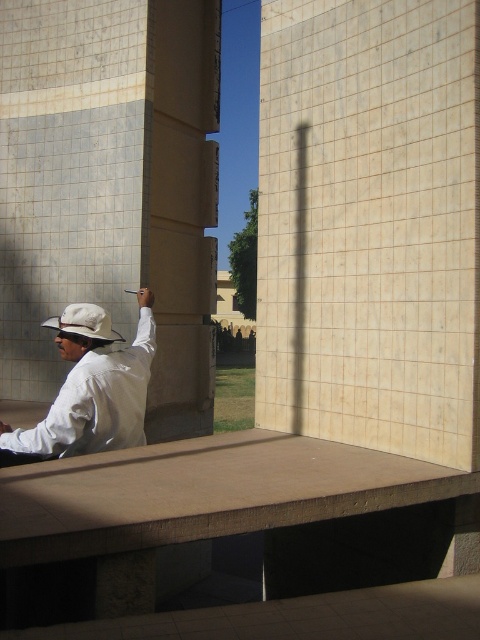
You are a photographer trying to capture the man and the smooth concrete ledge at center and the white matte hat at center in a single shot. Which object should you adjust your camera to focus on first if you want to include both in the frame without moving the camera?

You should focus on the white matte hat at center first because the smooth concrete ledge at center is positioned to its right, so adjusting focus towards the hat ensures both are within the frame.